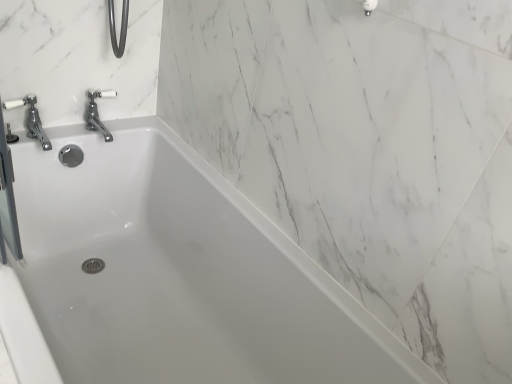
The width and height of the screenshot is (512, 384). I want to click on chrome/polished metal faucet at upper left, so click(x=31, y=120).

What is the approximate width of chrome/polished metal faucet at upper left?

8.44 inches.

This screenshot has width=512, height=384. What do you see at coordinates (31, 120) in the screenshot? I see `chrome/polished metal faucet at upper left` at bounding box center [31, 120].

Measure the distance between point (x=46, y=147) and camera.

The distance of point (x=46, y=147) from camera is 4.41 feet.

This screenshot has height=384, width=512. What do you see at coordinates (170, 276) in the screenshot?
I see `white glossy bathtub at center` at bounding box center [170, 276].

Measure the distance between white glossy bathtub at center and camera.

white glossy bathtub at center is 34.06 inches away from camera.

Locate an element on the screen. The image size is (512, 384). white glossy bathtub at center is located at coordinates (170, 276).

At what (x,y) coordinates should I click in order to perform the action: click on chrome/polished metal faucet at upper left. Please return your answer as a coordinate pair (x, y). Image resolution: width=512 pixels, height=384 pixels. Looking at the image, I should click on pyautogui.click(x=31, y=120).

Consider the image. Which is more to the left, chrome/polished metal faucet at upper left or white glossy bathtub at center?

chrome/polished metal faucet at upper left.

Does chrome/polished metal faucet at upper left lie behind white glossy bathtub at center?

Yes, chrome/polished metal faucet at upper left is further from the camera.

Between point (29, 135) and point (134, 230), which one is positioned in front?

Positioned in front is point (29, 135).

Looking at this image, from the image's perspective, is chrome/polished metal faucet at upper left positioned above or below white glossy bathtub at center?

Clearly, from the image's perspective, chrome/polished metal faucet at upper left is above white glossy bathtub at center.

In the scene shown: From a real-world perspective, is chrome/polished metal faucet at upper left physically located above or below white glossy bathtub at center?

In terms of real-world spatial position, chrome/polished metal faucet at upper left is above white glossy bathtub at center.

Considering the relative sizes of chrome/polished metal faucet at upper left and white glossy bathtub at center in the image provided, is chrome/polished metal faucet at upper left wider than white glossy bathtub at center?

In fact, chrome/polished metal faucet at upper left might be narrower than white glossy bathtub at center.

Does chrome/polished metal faucet at upper left have a lesser height compared to white glossy bathtub at center?

Yes, chrome/polished metal faucet at upper left is shorter than white glossy bathtub at center.

Who is smaller, chrome/polished metal faucet at upper left or white glossy bathtub at center?

chrome/polished metal faucet at upper left.

From the picture: Do you think chrome/polished metal faucet at upper left is within white glossy bathtub at center, or outside of it?

chrome/polished metal faucet at upper left is spatially situated outside white glossy bathtub at center.

Is chrome/polished metal faucet at upper left far from white glossy bathtub at center?

Actually, chrome/polished metal faucet at upper left and white glossy bathtub at center are a little close together.

Is chrome/polished metal faucet at upper left facing away from white glossy bathtub at center?

No, chrome/polished metal faucet at upper left is not facing the opposite direction of white glossy bathtub at center.

Where is `bathtub below the chrome/polished metal faucet at upper left (from a real-world perspective)`? The height and width of the screenshot is (384, 512). bathtub below the chrome/polished metal faucet at upper left (from a real-world perspective) is located at coordinates (170, 276).

Considering the relative positions of white glossy bathtub at center and chrome/polished metal faucet at upper left in the image provided, is white glossy bathtub at center to the left of chrome/polished metal faucet at upper left from the viewer's perspective?

Incorrect, white glossy bathtub at center is not on the left side of chrome/polished metal faucet at upper left.

Consider the image. Which is behind, white glossy bathtub at center or chrome/polished metal faucet at upper left?

Positioned behind is chrome/polished metal faucet at upper left.

Between point (25, 374) and point (13, 102), which one is positioned behind?

Positioned behind is point (13, 102).

From the image's perspective, is white glossy bathtub at center located above or below chrome/polished metal faucet at upper left?

white glossy bathtub at center is below chrome/polished metal faucet at upper left.

From a real-world perspective, relative to chrome/polished metal faucet at upper left, is white glossy bathtub at center vertically above or below?

In terms of real-world spatial position, white glossy bathtub at center is below chrome/polished metal faucet at upper left.

Which object is wider, white glossy bathtub at center or chrome/polished metal faucet at upper left?

Wider between the two is white glossy bathtub at center.

Does white glossy bathtub at center have a greater height compared to chrome/polished metal faucet at upper left?

Yes, white glossy bathtub at center is taller than chrome/polished metal faucet at upper left.

Looking at the image, does white glossy bathtub at center seem bigger or smaller compared to chrome/polished metal faucet at upper left?

white glossy bathtub at center is bigger than chrome/polished metal faucet at upper left.

Would you say chrome/polished metal faucet at upper left is part of white glossy bathtub at center's contents?

That's incorrect, chrome/polished metal faucet at upper left is not inside white glossy bathtub at center.

Is white glossy bathtub at center next to chrome/polished metal faucet at upper left and touching it?

No.

Is white glossy bathtub at center looking in the opposite direction of chrome/polished metal faucet at upper left?

No, white glossy bathtub at center's orientation is not away from chrome/polished metal faucet at upper left.

Can you tell me how much white glossy bathtub at center and chrome/polished metal faucet at upper left differ in facing direction?

90 degrees separate the facing orientations of white glossy bathtub at center and chrome/polished metal faucet at upper left.

This screenshot has width=512, height=384. Identify the location of bathtub that appears on the right of chrome/polished metal faucet at upper left. (170, 276).

Image resolution: width=512 pixels, height=384 pixels. Identify the location of bathtub located underneath the chrome/polished metal faucet at upper left (from a real-world perspective). (170, 276).

I want to click on bathtub located on the right of chrome/polished metal faucet at upper left, so click(170, 276).